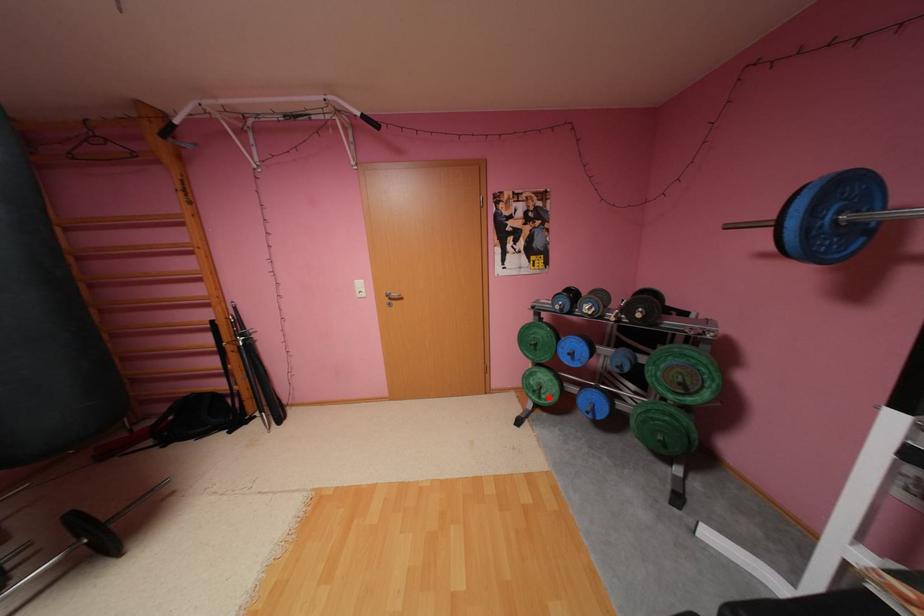
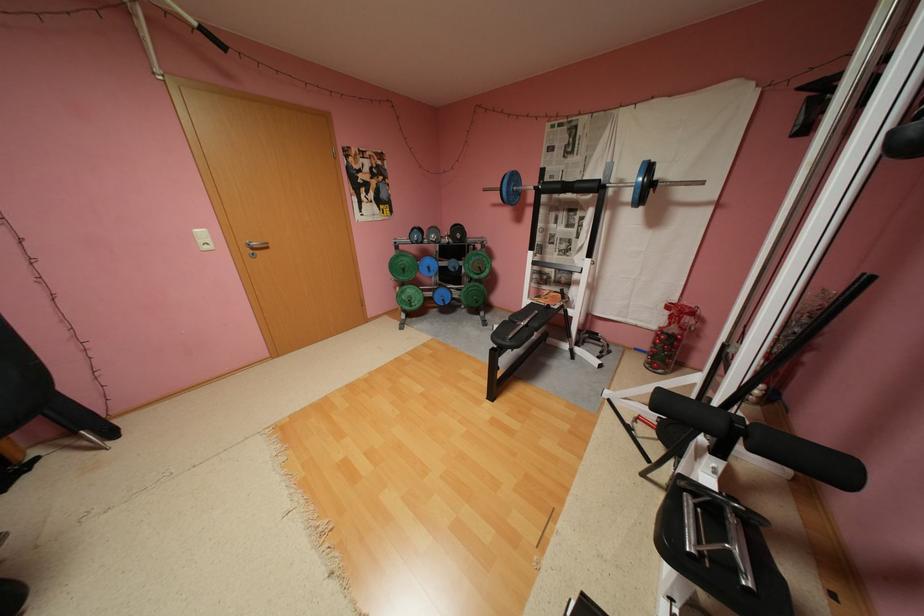
Locate, in the second image, the point that corresponds to the highlighted location in the first image.

(419, 306)